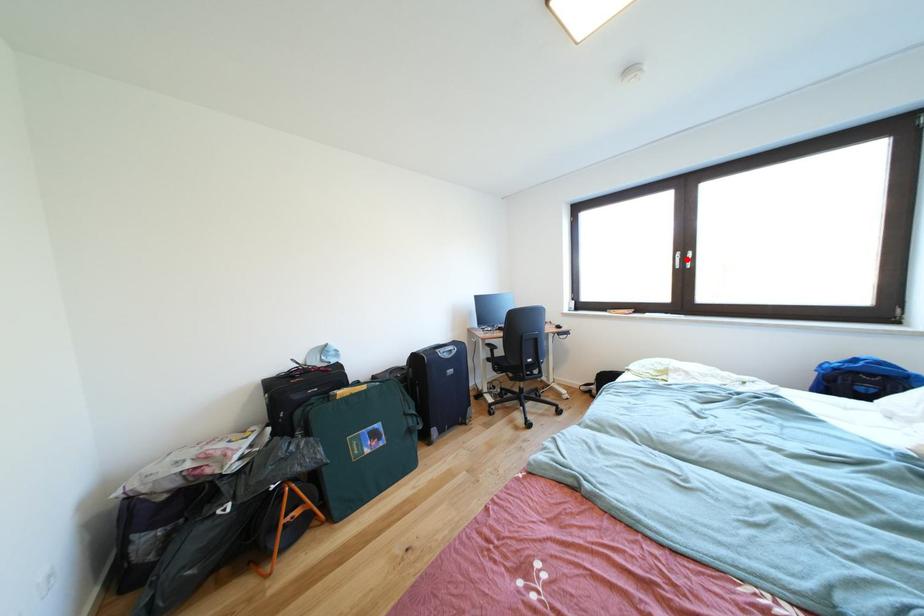
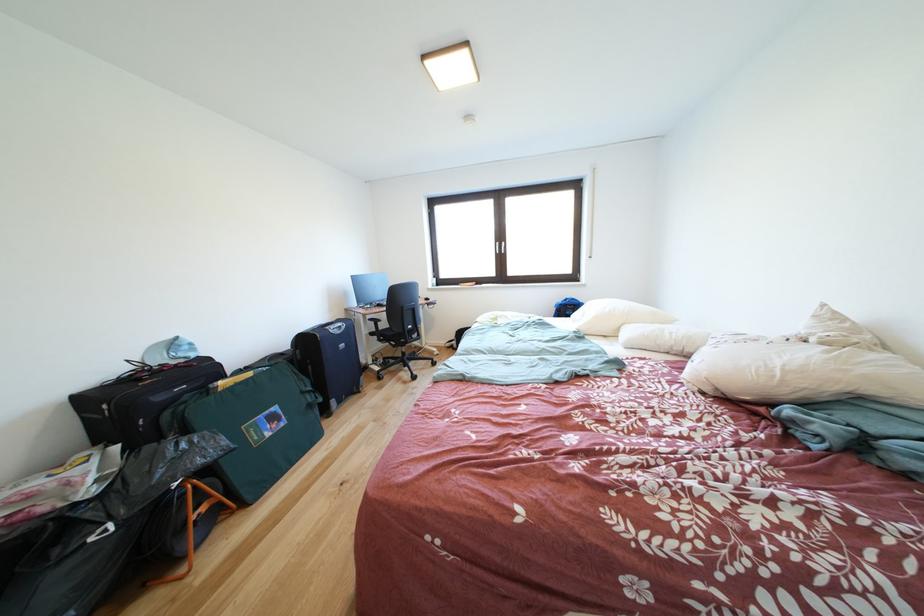
Question: I am providing you with two images of the same scene from different viewpoints. A red point is shown in image1. For the corresponding object point in image2, is it positioned nearer or farther from the camera?

Choices:
 (A) Nearer
 (B) Farther

Answer: (A)